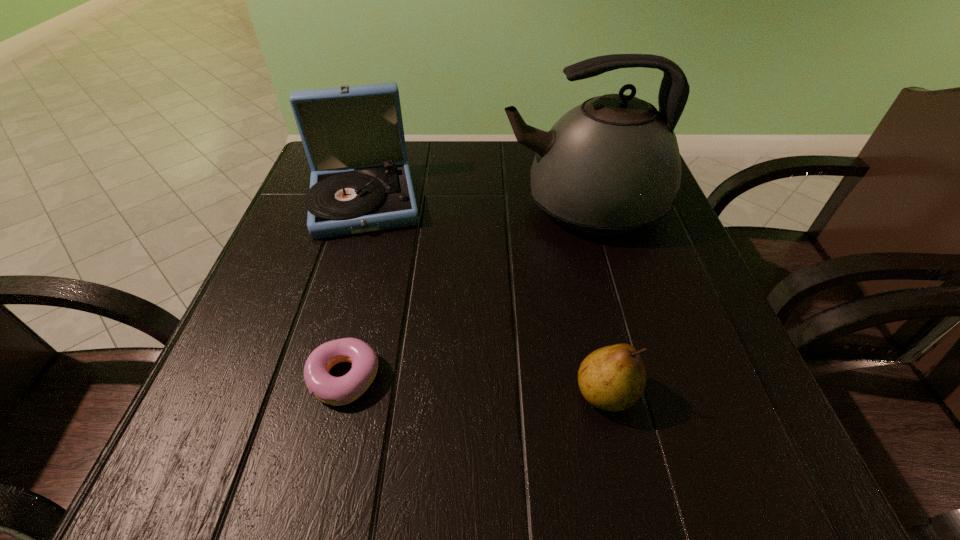
The width and height of the screenshot is (960, 540). Find the location of `free space between the kettle and the shortest object`. free space between the kettle and the shortest object is located at coordinates (464, 292).

Image resolution: width=960 pixels, height=540 pixels. Identify the location of vacant area that lies between the shortest object and the phonograph record. (354, 288).

This screenshot has height=540, width=960. I want to click on object that stands as the second closest to the doughnut, so click(612, 378).

In order to click on object that is the third closest to the tallest object in this screenshot , I will do `click(337, 391)`.

You are a GUI agent. You are given a task and a screenshot of the screen. Output one action in this format:
    pyautogui.click(x=<x>, y=<y>)
    Task: Click on the vacant space that satisfies the following two spatial constraints: 1. on the front side of the third shortest object; 2. on the left side of the pear
    The width and height of the screenshot is (960, 540).
    Given the screenshot: What is the action you would take?
    pyautogui.click(x=305, y=393)

I want to click on vacant space that satisfies the following two spatial constraints: 1. at the spout of the kettle; 2. on the front side of the shortest object, so click(630, 377).

At what (x,y) coordinates should I click in order to perform the action: click on vacant space that satisfies the following two spatial constraints: 1. at the spout of the tallest object; 2. on the front side of the second shortest object. Please return your answer as a coordinate pair (x, y). Looking at the image, I should click on (634, 393).

Image resolution: width=960 pixels, height=540 pixels. What are the coordinates of `free location that satisfies the following two spatial constraints: 1. at the spout of the tallest object; 2. on the front side of the pear` in the screenshot? It's located at (634, 393).

You are a GUI agent. You are given a task and a screenshot of the screen. Output one action in this format:
    pyautogui.click(x=<x>, y=<y>)
    Task: Click on the free location that satisfies the following two spatial constraints: 1. on the front side of the second tallest object; 2. on the right side of the pear
    The height and width of the screenshot is (540, 960).
    Given the screenshot: What is the action you would take?
    pyautogui.click(x=305, y=393)